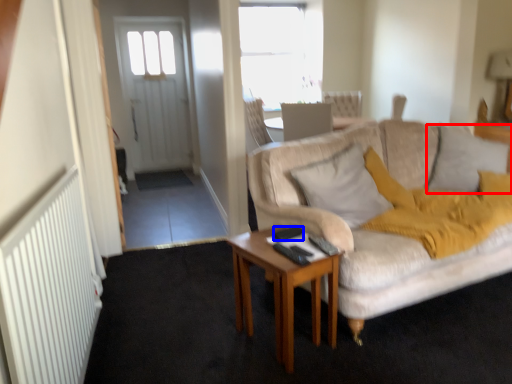
Question: Which point is closer to the camera, pillow (highlighted by a red box) or remote control (highlighted by a blue box)?

Choices:
 (A) pillow
 (B) remote control

Answer: (B)